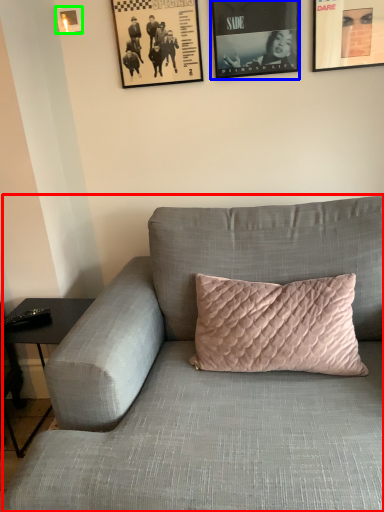
Question: Which object is the closest to the studio couch (highlighted by a red box)? Choose among these: picture frame (highlighted by a blue box) or picture frame (highlighted by a green box).

Choices:
 (A) picture frame
 (B) picture frame

Answer: (A)